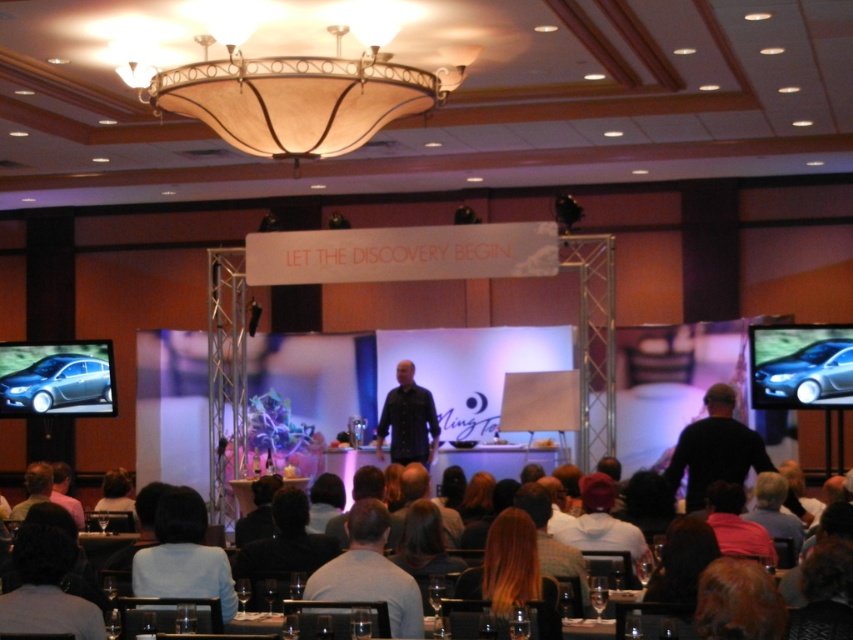
Question: Which point is farther from the camera taking this photo?

Choices:
 (A) (688, 458)
 (B) (27, 355)
 (C) (367, 573)

Answer: (B)

Question: Which point is farther to the camera?

Choices:
 (A) light blue fabric at lower center
 (B) black matte shirt at right

Answer: (B)

Question: Observing the image, what is the correct spatial positioning of translucent glass chandelier at upper center in reference to black shirt at center?

Choices:
 (A) right
 (B) left

Answer: (B)

Question: Is light blue fabric at lower center wider than black shirt at center?

Choices:
 (A) yes
 (B) no

Answer: (A)

Question: Where is metallic car at left located in relation to gray fabric shirt at center in the image?

Choices:
 (A) above
 (B) below

Answer: (A)

Question: Which of the following is the closest to the observer?

Choices:
 (A) (733, 394)
 (B) (811, 333)
 (C) (25, 396)
 (D) (169, 528)

Answer: (D)